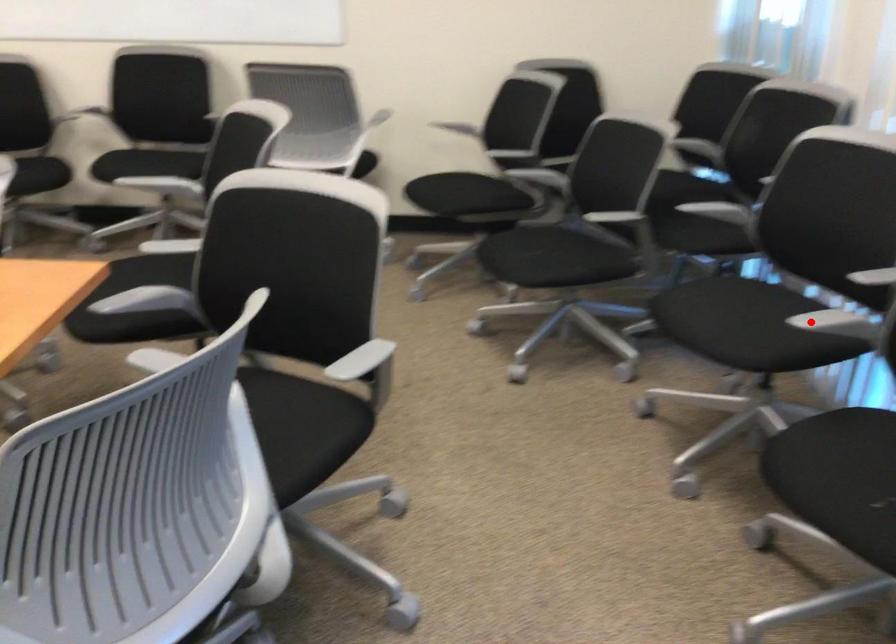
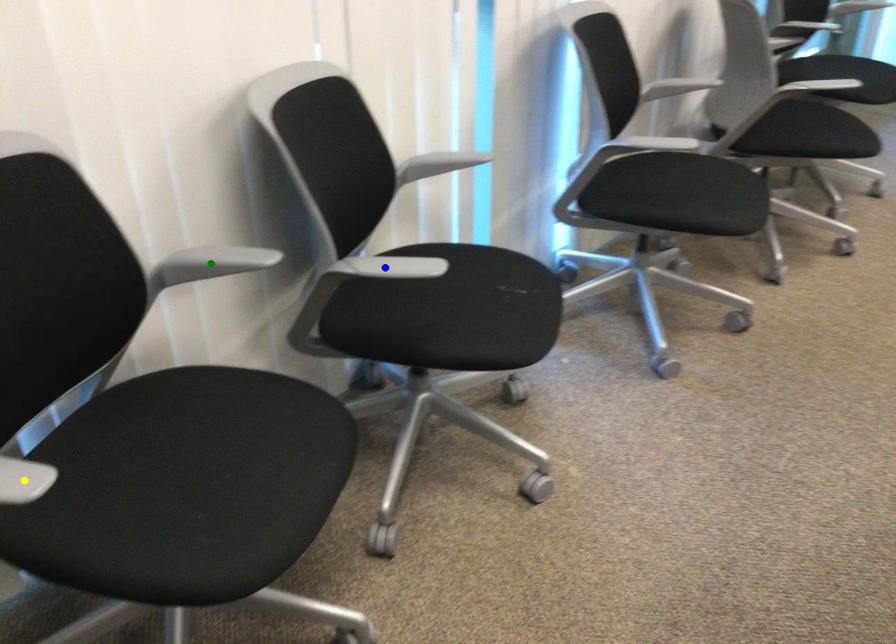
Question: I am providing you with two images of the same scene from different viewpoints. A red point is marked on the first image. You are given multiple points on the second image. In image 2, which mark is for the same physical point as the one in image 1?

Choices:
 (A) blue point
 (B) green point
 (C) yellow point

Answer: (A)